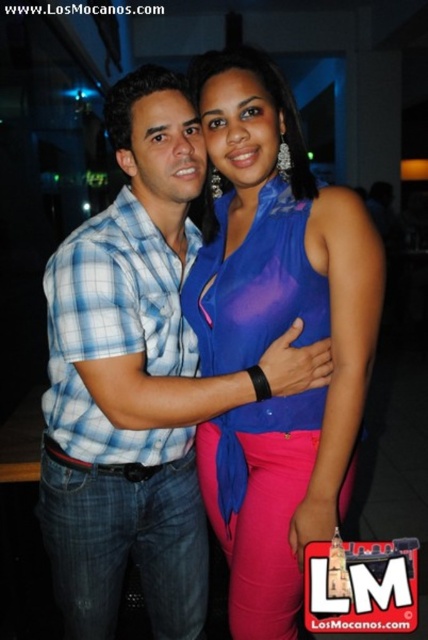
Question: Does blue plaid shirt at center appear under satin blue blouse at center?

Choices:
 (A) yes
 (B) no

Answer: (A)

Question: Where is blue plaid shirt at center located in relation to satin blue blouse at center in the image?

Choices:
 (A) below
 (B) above

Answer: (A)

Question: Which object is farther from the camera taking this photo?

Choices:
 (A) blue plaid shirt at center
 (B) satin blue blouse at center

Answer: (A)

Question: Is blue plaid shirt at center positioned at the back of satin blue blouse at center?

Choices:
 (A) no
 (B) yes

Answer: (B)

Question: Among these objects, which one is farthest from the camera?

Choices:
 (A) satin blue blouse at center
 (B) blue plaid shirt at center

Answer: (B)